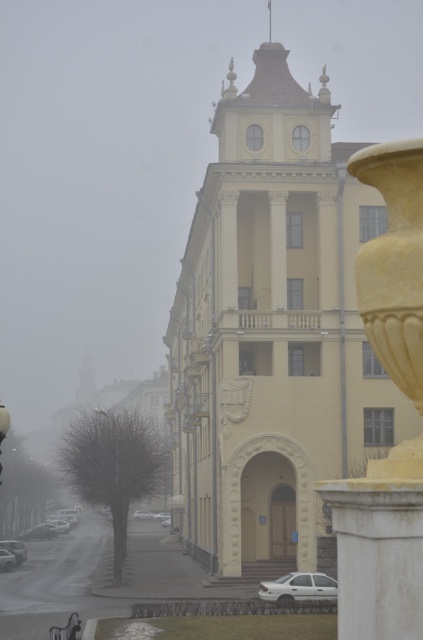
Question: Which point is closer to the camera?

Choices:
 (A) white marble pillar at right
 (B) white matte car at lower left
 (C) matte black car at lower left

Answer: (A)

Question: Which of the following is the farthest from the observer?

Choices:
 (A) (121, 486)
 (B) (8, 424)
 (C) (376, 244)
 (D) (2, 560)

Answer: (D)

Question: Is white matte car at lower left further to the viewer compared to brushed metal lamp post at left?

Choices:
 (A) yes
 (B) no

Answer: (A)

Question: Which object is positioned closest to the white matte car at lower center?

Choices:
 (A) brushed metal lamp post at left
 (B) white glossy car at lower left

Answer: (B)

Question: Does brushed metal lamp post at left have a smaller size compared to white glossy car at lower left?

Choices:
 (A) no
 (B) yes

Answer: (A)

Question: Is metallic gray streetlamp at left closer to the viewer compared to white glossy car at lower left?

Choices:
 (A) no
 (B) yes

Answer: (B)